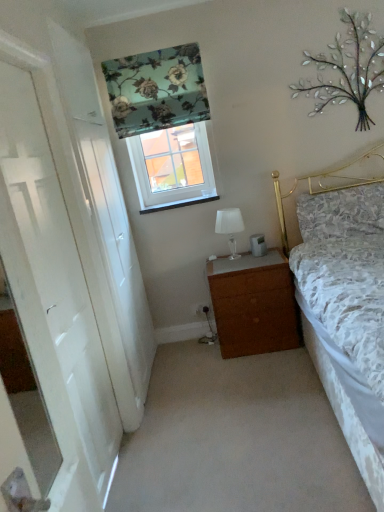
This screenshot has height=512, width=384. What are the coordinates of `vacant area situated below white glass table lamp at center (from a real-world perspective)` in the screenshot? It's located at (228, 254).